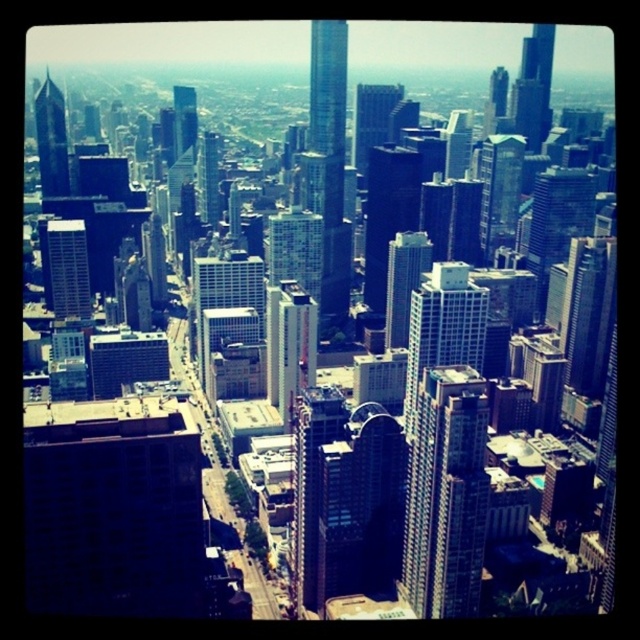
You are a drone operator preparing to fly a drone from your current position to the top of the sleek glass skyscraper at center. The drone has a maximum flight range of 2000 feet. Can the drone reach the skyscraper?

The sleek glass skyscraper at center is 2026.18 feet away from the viewer. Since the drone can only fly up to 2000 feet, it cannot reach the skyscraper.

You are a city planner analyzing the urban layout. In the image, you observe two skyscrapers at the center. Which of the two, the sleek glass skyscraper at center or the glassy reflective skyscraper at center, has a greater height?

The sleek glass skyscraper at center is taller than the glassy reflective skyscraper at center according to the description.

You are a drone operator who needs to fly your drone from the shiny glass skyscraper at upper left to the glassy reflective skyscraper at center. Based on the scene, which direction should you fly the drone to reach the destination?

The shiny glass skyscraper at upper left is located below the glassy reflective skyscraper at center, so you should fly the drone upward to reach the destination.